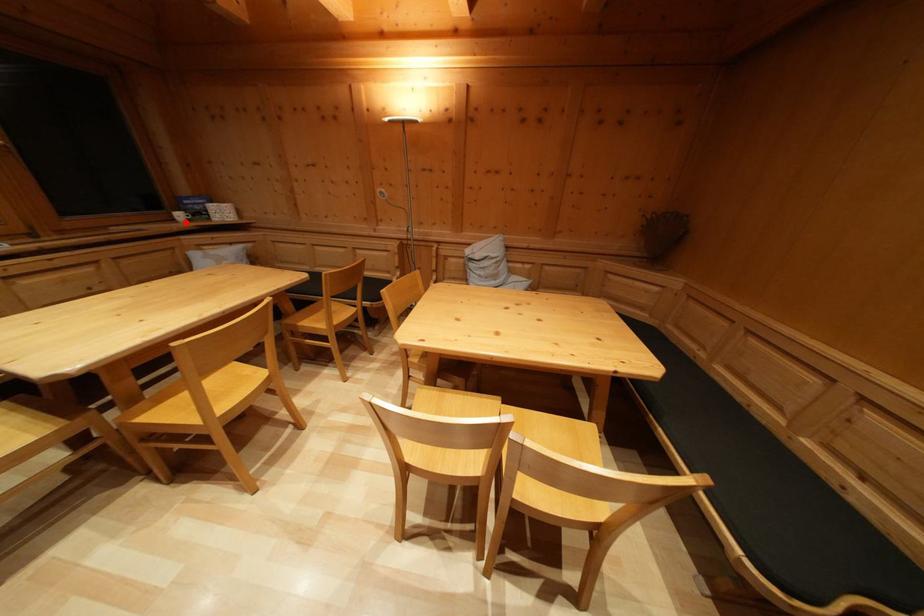
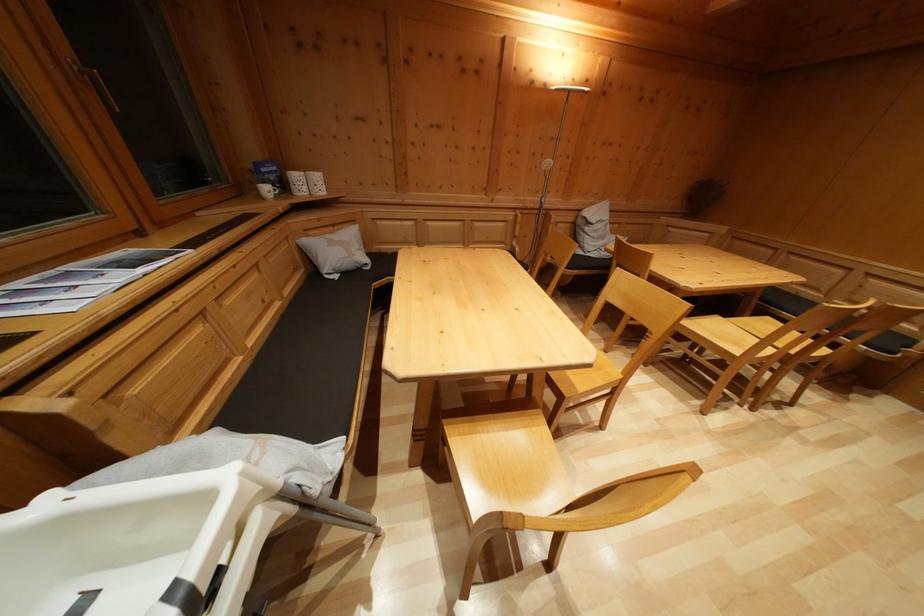
Locate, in the second image, the point that corresponds to the highlighted location in the first image.

(273, 197)